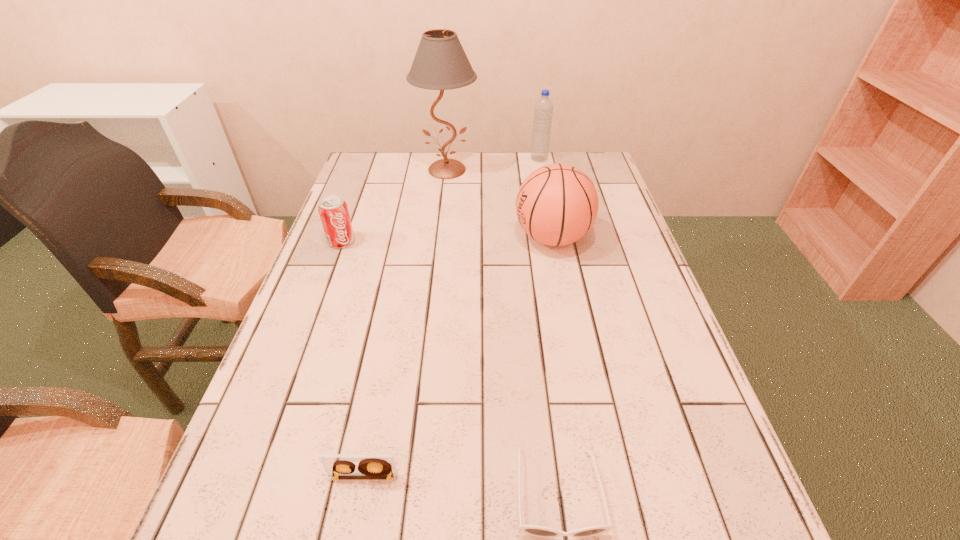
You are a GUI agent. You are given a task and a screenshot of the screen. Output one action in this format:
    pyautogui.click(x=<x>, y=<y>)
    Task: Click on the vacant space situated 0.190m on the surface of the basketball near the brand logo
    The width and height of the screenshot is (960, 540).
    Given the screenshot: What is the action you would take?
    pyautogui.click(x=444, y=238)

The height and width of the screenshot is (540, 960). What are the coordinates of `free location located 0.250m on the right of the leftmost object` in the screenshot? It's located at pos(446,241).

Identify the location of vacant space situated at the front of the videotape with visible reels. (352, 535).

Identify the location of table lamp present at the far edge. This screenshot has width=960, height=540. (440, 63).

Where is `water bottle at the far edge`? The image size is (960, 540). water bottle at the far edge is located at coordinates (543, 109).

Identify the location of object at the left edge. (333, 210).

At what (x,y) coordinates should I click in order to perform the action: click on object positioned at the right edge. Please return your answer as a coordinate pair (x, y). This screenshot has height=540, width=960. Looking at the image, I should click on (557, 204).

Find the location of a particular element. free region at the far edge of the desktop is located at coordinates point(434,157).

Locate an element on the screen. This screenshot has height=540, width=960. free space at the near edge is located at coordinates pos(423,532).

Locate an element on the screen. This screenshot has height=540, width=960. free space at the left edge is located at coordinates (317, 343).